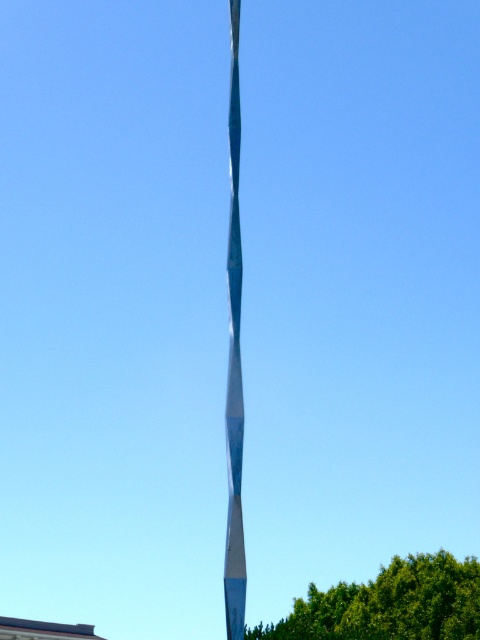
Question: Can you confirm if green leafy tree at lower center is smaller than shiny blue pole at center?

Choices:
 (A) no
 (B) yes

Answer: (A)

Question: Which object appears farthest from the camera in this image?

Choices:
 (A) green leafy tree at lower center
 (B) shiny blue pole at center

Answer: (A)

Question: Which point is closer to the camera?

Choices:
 (A) (336, 634)
 (B) (239, 282)

Answer: (B)

Question: Which point is closer to the camera taking this photo?

Choices:
 (A) (240, 483)
 (B) (448, 596)

Answer: (A)

Question: Is green leafy tree at lower center closer to the viewer compared to shiny blue pole at center?

Choices:
 (A) no
 (B) yes

Answer: (A)

Question: Is green leafy tree at lower center below shiny blue pole at center?

Choices:
 (A) yes
 (B) no

Answer: (A)